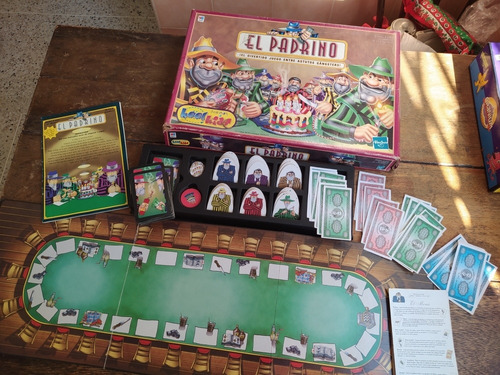
Identify the location of floor. (23, 48).